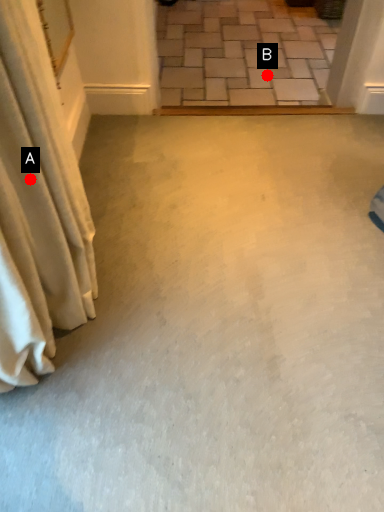
Question: Two points are circled on the image, labeled by A and B beside each circle. Which point is closer to the camera?

Choices:
 (A) A is closer
 (B) B is closer

Answer: (A)